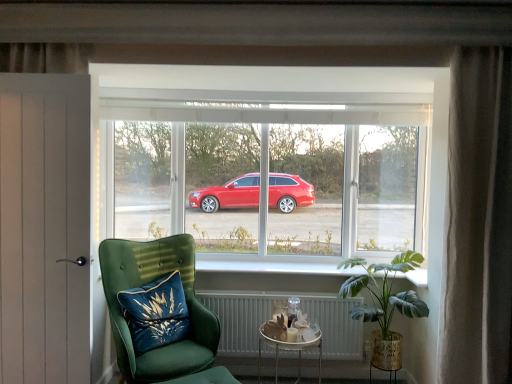
At what (x,y) coordinates should I click in order to perform the action: click on empty space that is ontop of white metallic radiator at lower center. Please return your answer as a coordinate pair (x, y). The image size is (512, 384). Looking at the image, I should click on (283, 281).